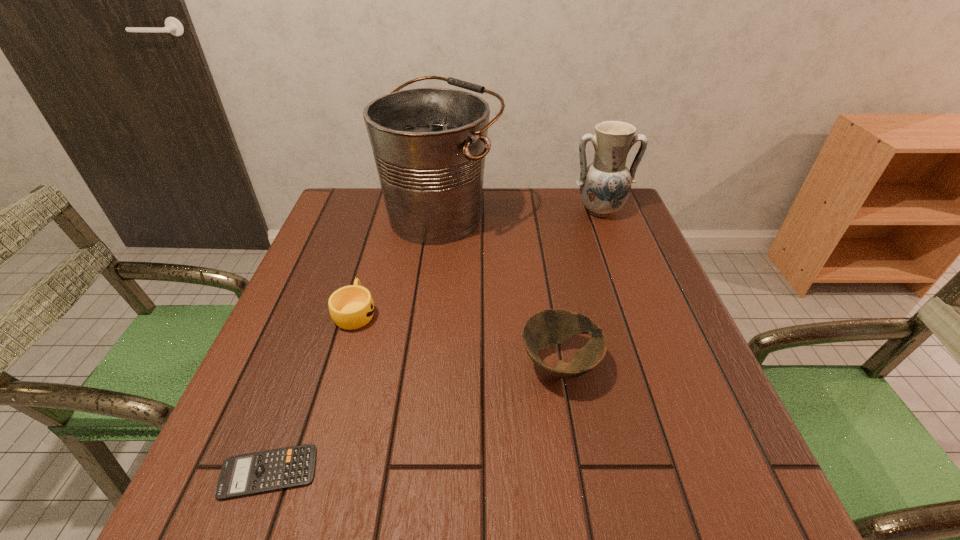
The width and height of the screenshot is (960, 540). I want to click on vacant region located on either side of the pottery, so click(x=611, y=238).

Locate an element on the screen. The width and height of the screenshot is (960, 540). free space located on the front of the third tallest object is located at coordinates (586, 519).

I want to click on free space located 0.180m on the front of the third farthest object, so click(327, 407).

Identify the location of vacant space situated on the right of the nearest object. The width and height of the screenshot is (960, 540). (458, 472).

The width and height of the screenshot is (960, 540). Identify the location of bucket at the far edge. (429, 144).

The image size is (960, 540). I want to click on pottery that is at the far edge, so click(x=605, y=185).

Locate an element on the screen. This screenshot has height=540, width=960. object located in the near edge section of the desktop is located at coordinates (259, 472).

This screenshot has width=960, height=540. In order to click on bucket that is at the left edge in this screenshot , I will do `click(429, 144)`.

Image resolution: width=960 pixels, height=540 pixels. Identify the location of cup present at the left edge. (351, 307).

Image resolution: width=960 pixels, height=540 pixels. What are the coordinates of `calculator present at the left edge` in the screenshot? It's located at (259, 472).